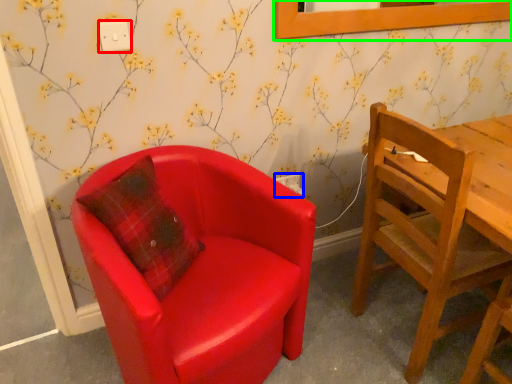
Question: Which is farther away from power outlet (highlighted by a red box)? power outlet (highlighted by a blue box) or picture frame (highlighted by a green box)?

Choices:
 (A) power outlet
 (B) picture frame

Answer: (B)